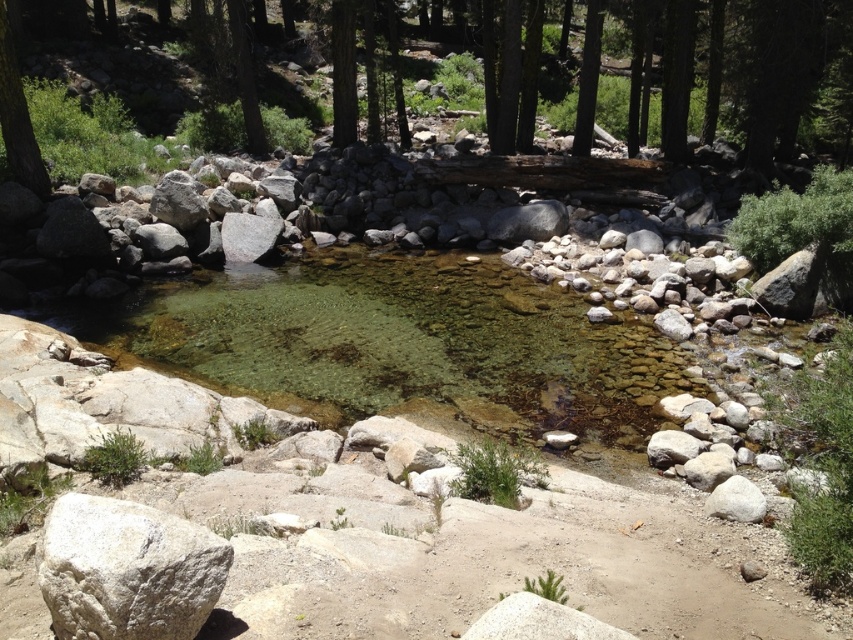
You are a hiker trying to cross the stream. You see the white rough boulder at lower left and the smooth bark tree at left. Which one is narrower?

The white rough boulder at lower left is narrower than the smooth bark tree at left.

Based on the photo, you are a hiker trying to cross the stream in the image. You notice two points marked on the stream bed. The first point is at coordinates point (123,600) and the second is at point (12,157). Which point would you reach first if you start from the left bank and move towards the right bank along the stream?

Point (123,600) is in front of point (12,157), so you would reach point (123,600) first when moving from the left bank to the right bank along the stream.